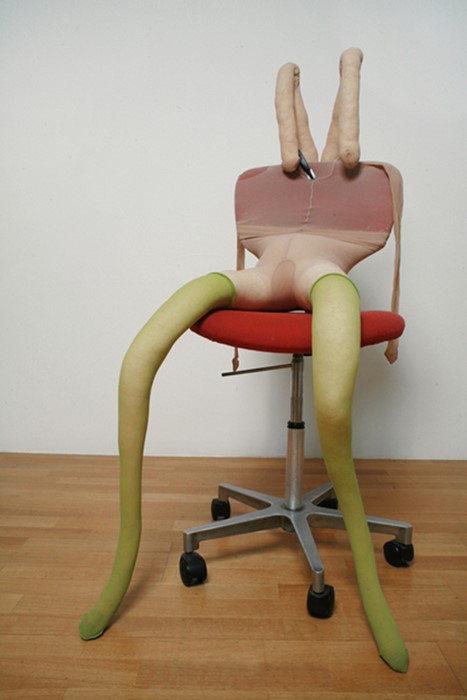
The height and width of the screenshot is (700, 467). I want to click on chair rollers, so click(323, 603), click(195, 574), click(395, 559).